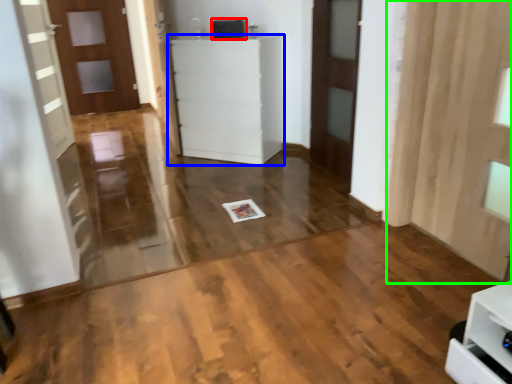
Question: Which object is positioned closest to appliance (highlighted by a red box)? Select from furniture (highlighted by a blue box) and curtain (highlighted by a green box).

Choices:
 (A) furniture
 (B) curtain

Answer: (A)